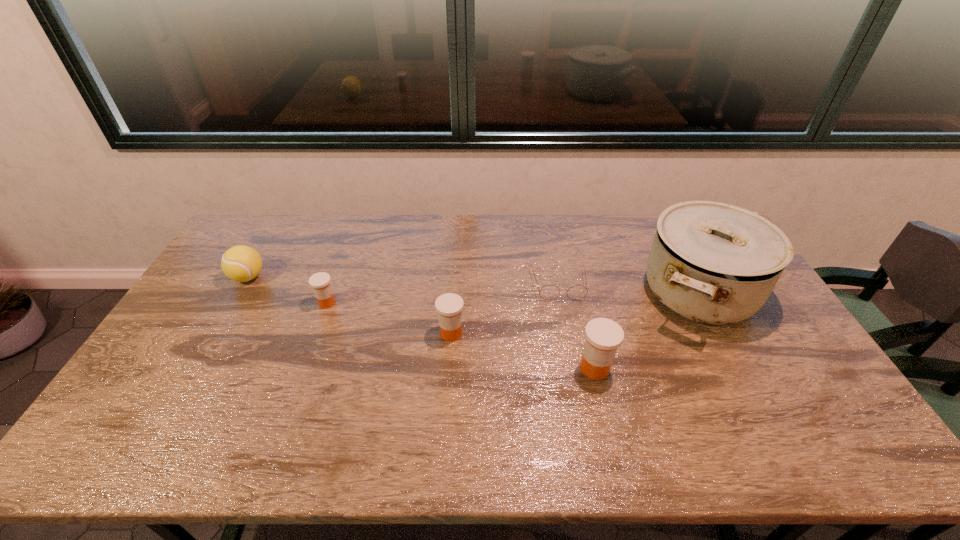
You are a GUI agent. You are given a task and a screenshot of the screen. Output one action in this format:
    pyautogui.click(x=<x>, y=<y>)
    Task: Click on the medicine that is the second closest to the rightmost medicine
    Image resolution: width=960 pixels, height=540 pixels.
    Given the screenshot: What is the action you would take?
    pyautogui.click(x=320, y=282)

Choose which medicine is the second nearest neighbor to the tallest object. Please provide its 2D coordinates. Your answer should be formatted as a tuple, i.e. [(x, y)], where the tuple contains the x and y coordinates of a point satisfying the conditions above.

[(449, 306)]